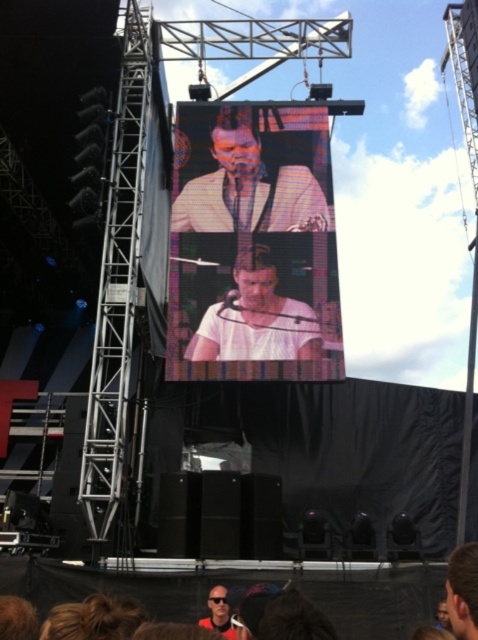
Question: Based on their relative distances, which object is nearer to the smooth white shirt at center?

Choices:
 (A) brown hair at lower center
 (B) matte black sunglasses at lower center
 (C) pixelated screen at center

Answer: (A)

Question: Can you confirm if brown hair at lower center is wider than matte white shirt at center?

Choices:
 (A) no
 (B) yes

Answer: (B)

Question: Based on their relative distances, which object is farther from the white matte shirt at center?

Choices:
 (A) brown hair at lower center
 (B) matte black sunglasses at lower center

Answer: (B)

Question: Among these objects, which one is nearest to the camera?

Choices:
 (A) white matte shirt at center
 (B) smooth white shirt at center

Answer: (B)

Question: Can you confirm if white matte shirt at center is bigger than smooth white shirt at center?

Choices:
 (A) no
 (B) yes

Answer: (B)

Question: Can you confirm if smooth white shirt at center is positioned below matte black sunglasses at lower center?

Choices:
 (A) yes
 (B) no

Answer: (B)